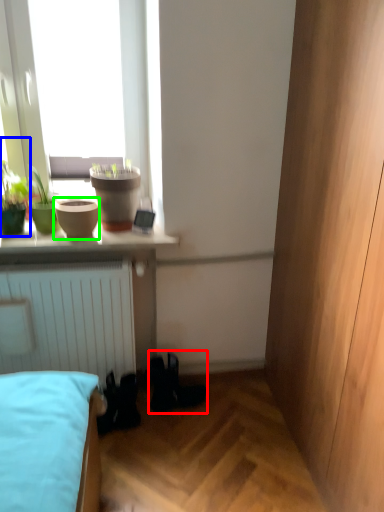
Question: Considering the real-world distances, which object is farthest from shoe (highlighted by a red box)? houseplant (highlighted by a blue box) or flowerpot (highlighted by a green box)?

Choices:
 (A) houseplant
 (B) flowerpot

Answer: (A)